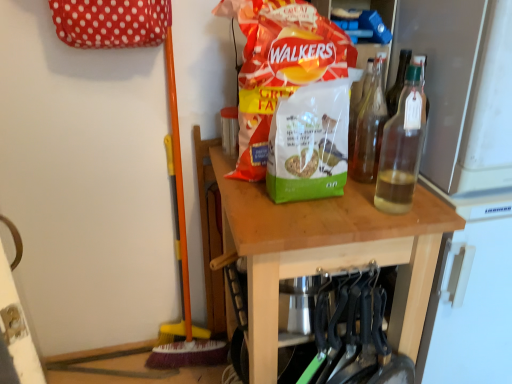
Find the location of `free point behind clear glass bottle at upper right, which is the first bottle in front-to-back order`. free point behind clear glass bottle at upper right, which is the first bottle in front-to-back order is located at coordinates (370, 189).